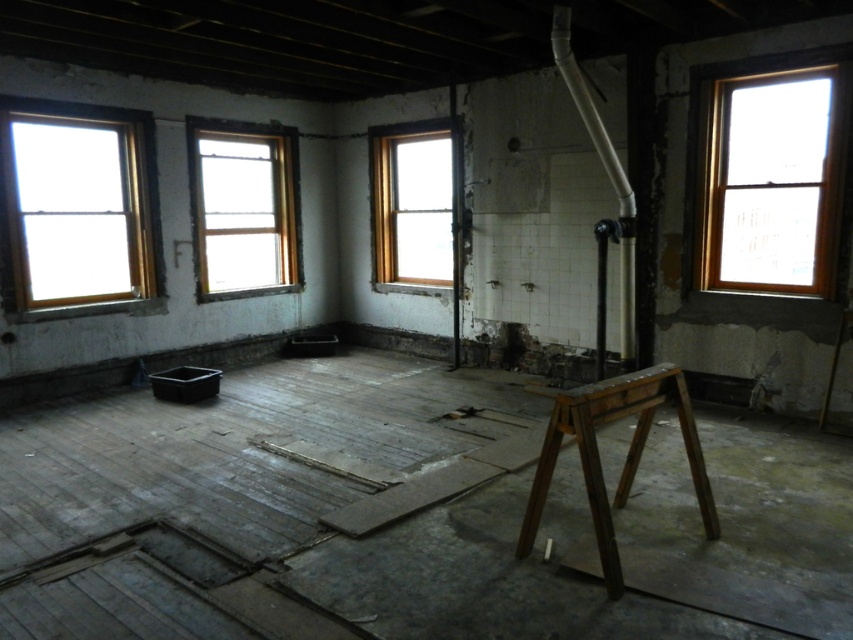
Is wooden frame window at upper right positioned at the back of clear glass window at center?

No, wooden frame window at upper right is closer to the viewer.

Does point (828, 228) lie in front of point (201, 196)?

Yes, it is in front of point (201, 196).

Measure the distance between point [738,100] and camera.

5.16 meters

Identify the location of wooden frame window at upper right. Image resolution: width=853 pixels, height=640 pixels. (773, 180).

The image size is (853, 640). Identify the location of clear glass window at center. (242, 208).

Is clear glass window at center above dark brown wooden stool at center?

Yes, clear glass window at center is above dark brown wooden stool at center.

Is point (264, 225) closer to viewer compared to point (614, 506)?

No, (264, 225) is further to viewer.

Where is `clear glass window at center`? This screenshot has width=853, height=640. clear glass window at center is located at coordinates (242, 208).

Is wooden frame window at upper right further to camera compared to wooden frame window at center?

No, it is not.

Which is more to the left, wooden frame window at upper right or wooden frame window at center?

Positioned to the left is wooden frame window at center.

Where is `wooden frame window at upper right`? wooden frame window at upper right is located at coordinates (773, 180).